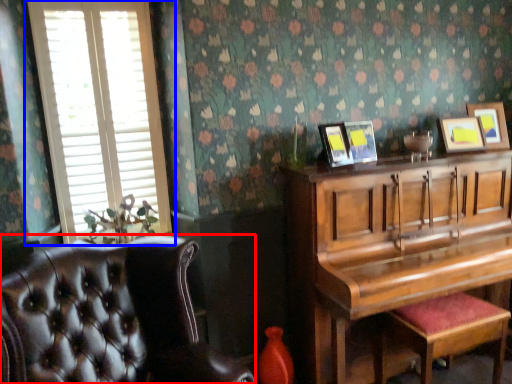
Question: Which object appears farthest to the camera in this image, chair (highlighted by a red box) or window (highlighted by a blue box)?

Choices:
 (A) chair
 (B) window

Answer: (B)